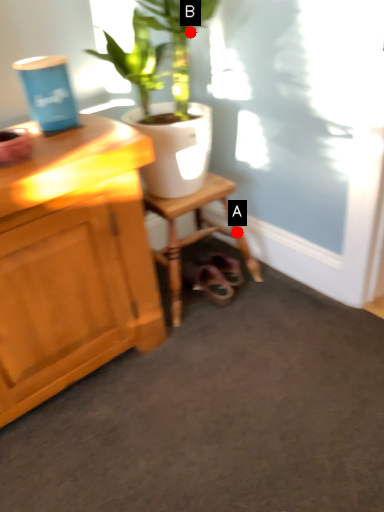
Question: Two points are circled on the image, labeled by A and B beside each circle. Which point appears farthest from the camera in this image?

Choices:
 (A) A is further
 (B) B is further

Answer: (A)